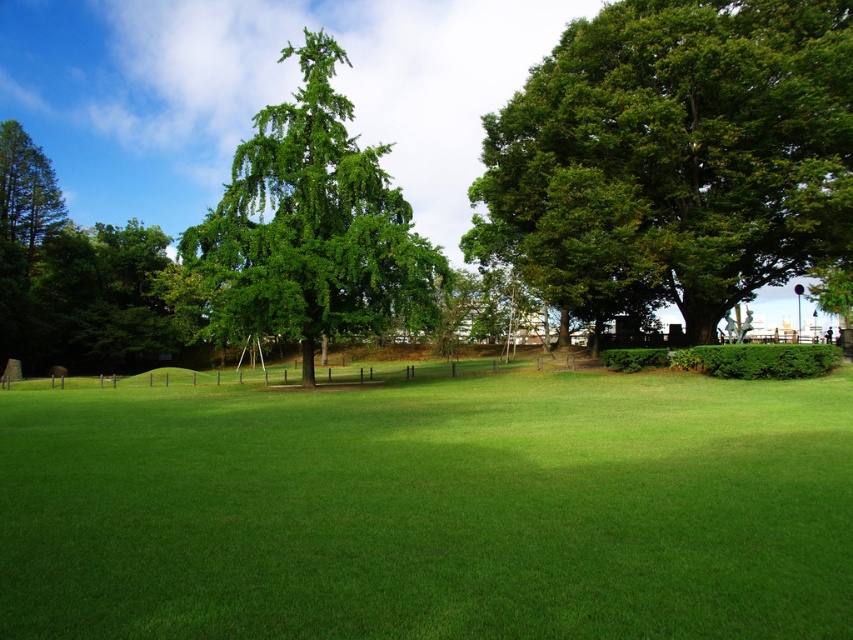
Based on the coordinates provided, which object is located at point (430, 508) in the park scene?

The green grass at center is located at point (430, 508).

In the scene shown: You are a gardener planning to mow the green grass at center and trim the green leafy tree at right. Based on their positions, which task should you tackle first if you start from the entrance at the bottom of the image?

The green grass at center is in front of the green leafy tree at right, so you should mow the green grass at center first before trimming the green leafy tree at right.

You are a park visitor who wants to take a photo of both the green leafy tree at right and the green leafy tree at center. Which direction should you walk to ensure both trees are visible in your camera frame?

You should walk to the left of both green leafy tree at right and green leafy tree at center so that the green leafy tree at right is positioned to the right side of the green leafy tree at center in the frame.